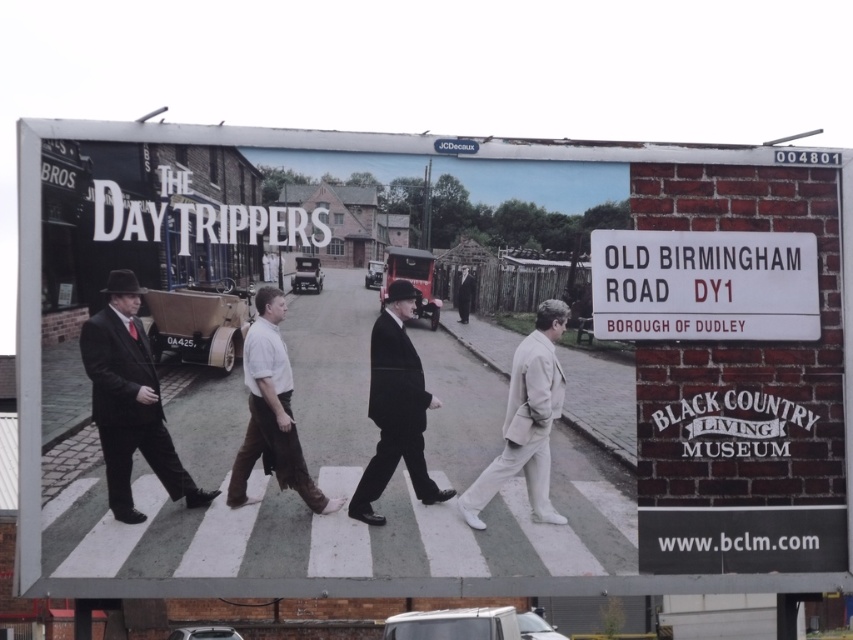
Measure the distance between point (399, 346) and camera.

Point (399, 346) and camera are 23.90 feet apart.

Which is above, black wool suit at center or dark gray suit at center?

dark gray suit at center

I want to click on black wool suit at center, so click(x=395, y=408).

Does matte black signboard at upper center appear under brown cotton pants at center?

Indeed, matte black signboard at upper center is positioned under brown cotton pants at center.

Is point (235, 241) positioned in front of point (262, 349)?

No, it is behind (262, 349).

Does point (637, 305) come closer to viewer compared to point (273, 339)?

No, (637, 305) is behind (273, 339).

This screenshot has width=853, height=640. I want to click on matte black signboard at upper center, so click(450, 380).

Is matte black signboard at upper center further to camera compared to matte black suit at center?

No, it is in front of matte black suit at center.

Does matte black signboard at upper center appear over matte black suit at center?

Actually, matte black signboard at upper center is below matte black suit at center.

What do you see at coordinates (450, 380) in the screenshot? The width and height of the screenshot is (853, 640). I see `matte black signboard at upper center` at bounding box center [450, 380].

In order to click on matte black signboard at upper center in this screenshot , I will do tap(450, 380).